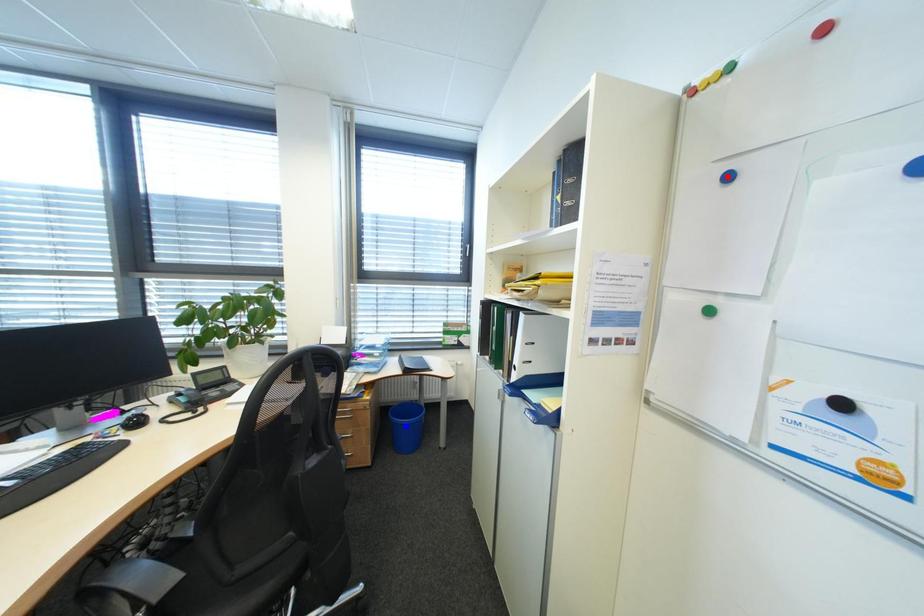
Question: Two points are marked on the image. Which point is closer to the camera?

Choices:
 (A) Blue point is closer.
 (B) Red point is closer.

Answer: (B)